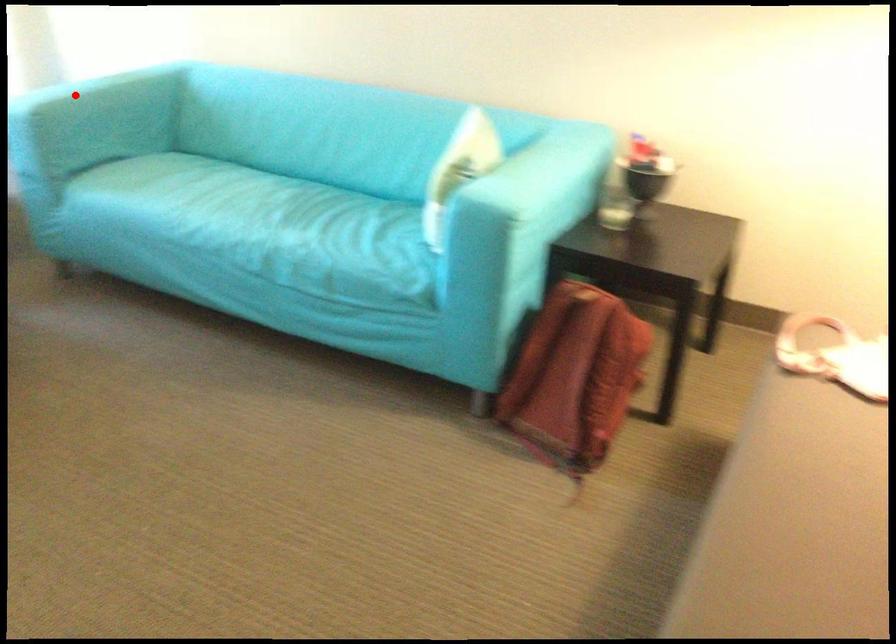
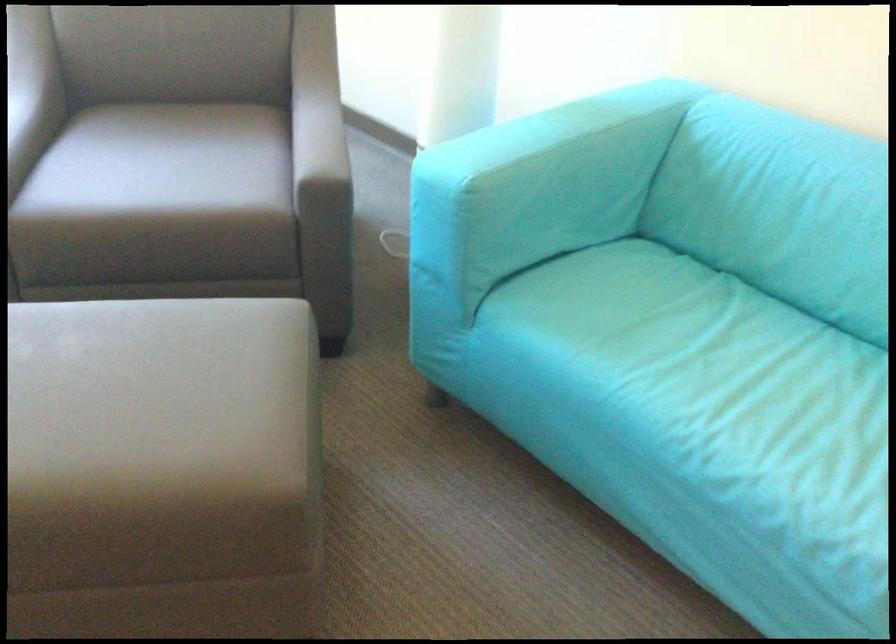
Where in the second image is the point corresponding to the highlighted location from the first image?

(554, 162)